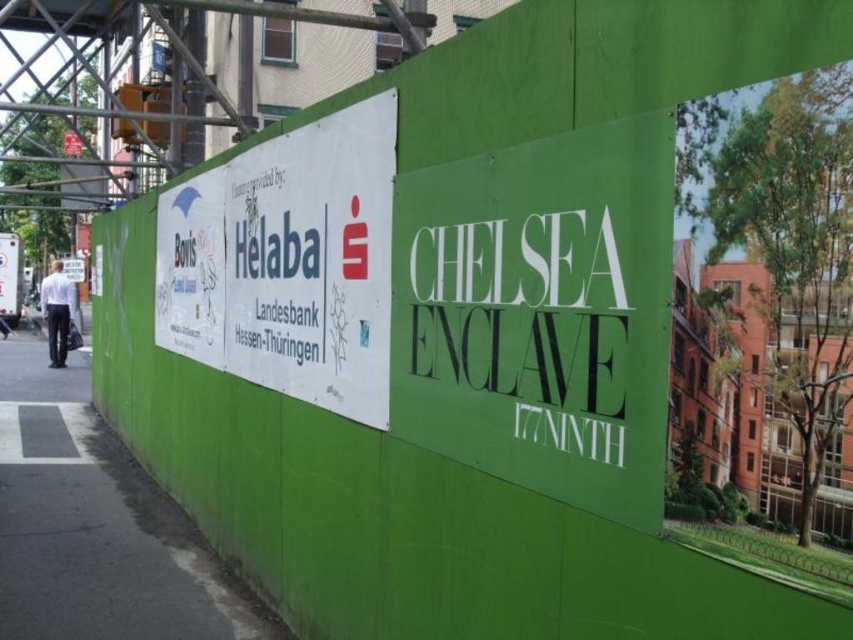
Does green matte sign at center have a larger size compared to white paper sign at center?

No, green matte sign at center is not bigger than white paper sign at center.

Who is positioned more to the left, green matte sign at center or white paper sign at center?

white paper sign at center

Who is more forward, (x=637, y=372) or (x=370, y=212)?

Point (x=637, y=372)

Locate an element on the screen. green matte sign at center is located at coordinates (541, 314).

Describe the element at coordinates (288, 262) in the screenshot. I see `white paper sign at center` at that location.

Which of these two, white paper sign at center or green asphalt pavement at lower left, stands taller?

With more height is white paper sign at center.

Which is behind, point (210, 330) or point (97, 554)?

The point (210, 330) is behind.

You are a GUI agent. You are given a task and a screenshot of the screen. Output one action in this format:
    pyautogui.click(x=<x>, y=<y>)
    Task: Click on the white paper sign at center
    The width and height of the screenshot is (853, 640).
    Given the screenshot: What is the action you would take?
    pyautogui.click(x=288, y=262)

Is green matte sign at center thinner than green asphalt pavement at lower left?

Correct, green matte sign at center's width is less than green asphalt pavement at lower left's.

Can you confirm if green matte sign at center is positioned below green asphalt pavement at lower left?

Incorrect, green matte sign at center is not positioned below green asphalt pavement at lower left.

The width and height of the screenshot is (853, 640). What are the coordinates of `green matte sign at center` in the screenshot? It's located at (541, 314).